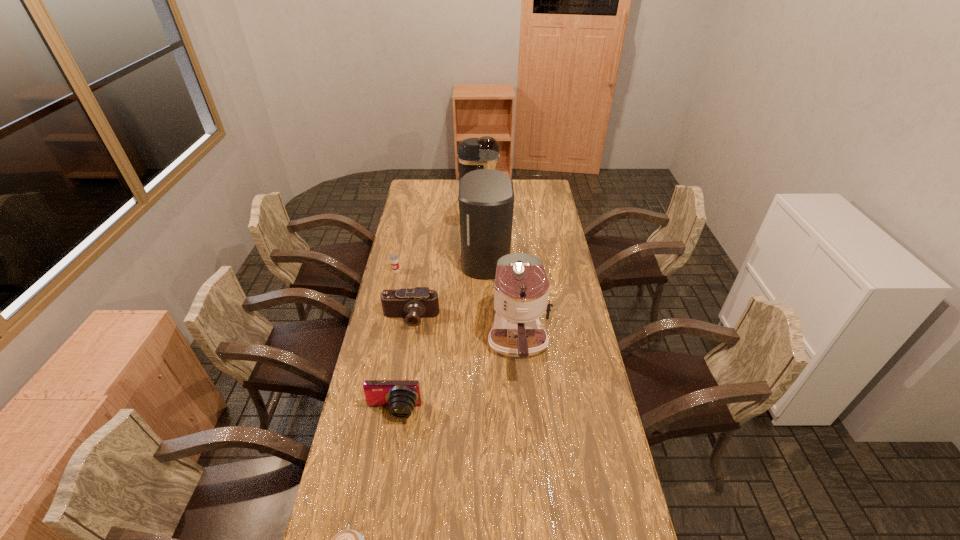
The image size is (960, 540). What are the coordinates of `free spot that satisfies the following two spatial constraints: 1. on the button side of the second farthest coffee maker; 2. on the front-facing side of the nearer camera` in the screenshot? It's located at (487, 411).

Locate an element on the screen. This screenshot has width=960, height=540. free space that satisfies the following two spatial constraints: 1. place cup under the spout of the farthest coffee maker; 2. on the side of the cup with the logo is located at coordinates (478, 271).